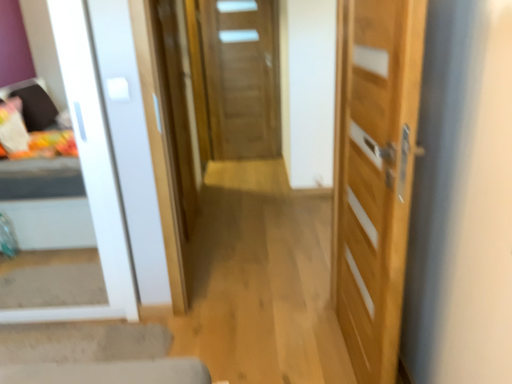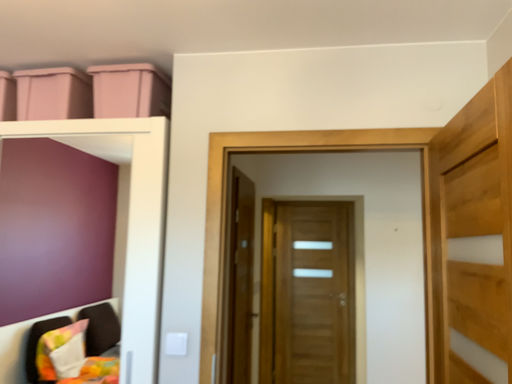
Question: Which way did the camera rotate in the video?

Choices:
 (A) rotated right
 (B) rotated left

Answer: (B)